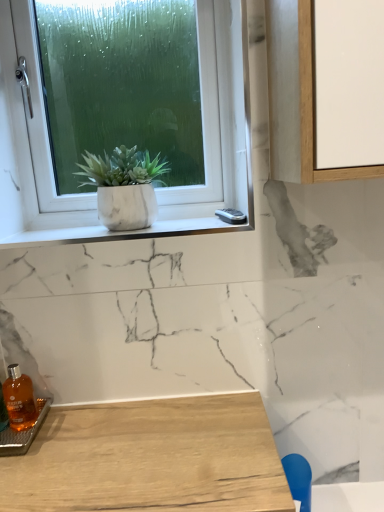
Question: From the image's perspective, is white marble window sill at upper left on top of blue plastic chair at lower right?

Choices:
 (A) yes
 (B) no

Answer: (A)

Question: Is white marble window sill at upper left facing towards blue plastic chair at lower right?

Choices:
 (A) no
 (B) yes

Answer: (A)

Question: Is white marble window sill at upper left to the right of blue plastic chair at lower right from the viewer's perspective?

Choices:
 (A) no
 (B) yes

Answer: (A)

Question: Does white marble window sill at upper left appear on the left side of blue plastic chair at lower right?

Choices:
 (A) no
 (B) yes

Answer: (B)

Question: From a real-world perspective, is white marble window sill at upper left located beneath blue plastic chair at lower right?

Choices:
 (A) no
 (B) yes

Answer: (A)

Question: Is translucent amber glass bottle at lower left wider or thinner than white matte window at upper left?

Choices:
 (A) wide
 (B) thin

Answer: (A)

Question: Visually, is translucent amber glass bottle at lower left positioned to the left or to the right of white matte window at upper left?

Choices:
 (A) right
 (B) left

Answer: (B)

Question: From the image's perspective, is translucent amber glass bottle at lower left above or below white matte window at upper left?

Choices:
 (A) below
 (B) above

Answer: (A)

Question: In terms of size, does translucent amber glass bottle at lower left appear bigger or smaller than white matte window at upper left?

Choices:
 (A) big
 (B) small

Answer: (B)

Question: From a real-world perspective, is white marble pot at upper left above or below white matte window at upper left?

Choices:
 (A) below
 (B) above

Answer: (A)

Question: Is white marble pot at upper left inside or outside of white matte window at upper left?

Choices:
 (A) outside
 (B) inside

Answer: (A)

Question: Considering their positions, is white marble pot at upper left located in front of or behind white matte window at upper left?

Choices:
 (A) front
 (B) behind

Answer: (A)

Question: From their relative heights in the image, would you say white marble pot at upper left is taller or shorter than white matte window at upper left?

Choices:
 (A) tall
 (B) short

Answer: (B)

Question: In terms of height, does blue plastic chair at lower right look taller or shorter compared to white marble window sill at upper left?

Choices:
 (A) short
 (B) tall

Answer: (B)

Question: Considering the positions of blue plastic chair at lower right and white marble window sill at upper left in the image, is blue plastic chair at lower right bigger or smaller than white marble window sill at upper left?

Choices:
 (A) small
 (B) big

Answer: (A)